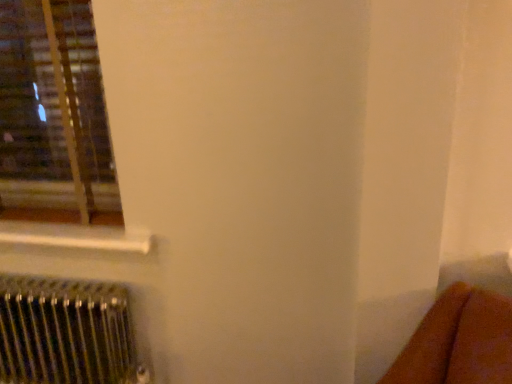
Locate an element on the screen. metallic silver radiator at lower left is located at coordinates (67, 333).

Describe the element at coordinates (67, 333) in the screenshot. Image resolution: width=512 pixels, height=384 pixels. I see `metallic silver radiator at lower left` at that location.

Locate an element on the screen. Image resolution: width=512 pixels, height=384 pixels. metallic silver radiator at lower left is located at coordinates (67, 333).